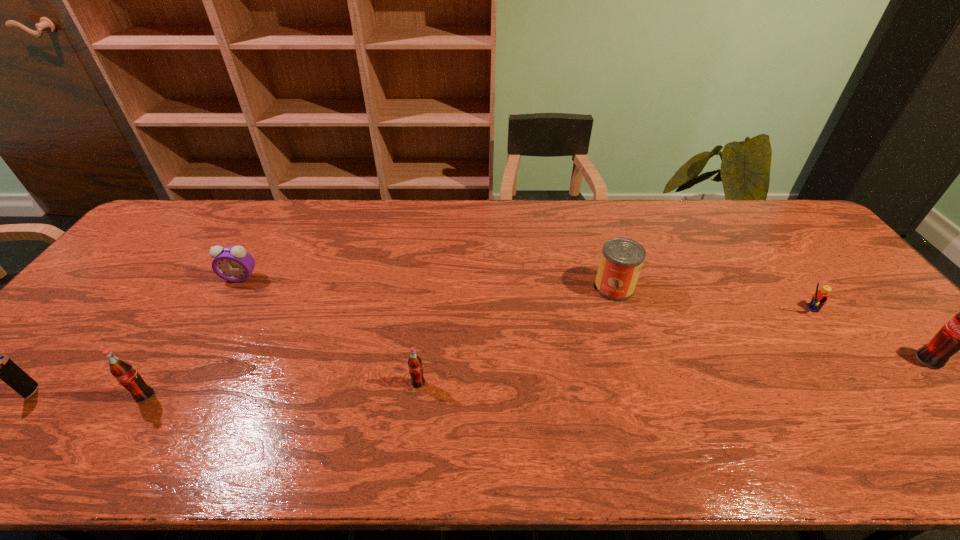
Locate an element on the screen. The width and height of the screenshot is (960, 540). free space that is in between the second tallest soda bottle and the tallest soda bottle is located at coordinates (537, 378).

Identify the location of free space between the third object from right to left and the leftmost object. (323, 339).

The height and width of the screenshot is (540, 960). What are the coordinates of `free space that is in between the fourth object from left to right and the third object from right to left` in the screenshot? It's located at (516, 335).

Where is `vacant space that's between the alarm clock and the fourth object from left to right`? This screenshot has height=540, width=960. vacant space that's between the alarm clock and the fourth object from left to right is located at coordinates (329, 330).

You are a GUI agent. You are given a task and a screenshot of the screen. Output one action in this format:
    pyautogui.click(x=<x>, y=<y>)
    Task: Click on the vacant area between the fourth object from right to left and the sixth object from left to right
    
    Given the screenshot: What is the action you would take?
    pyautogui.click(x=612, y=346)

Identify the location of object identified as the closest to the fourth object from right to left. Image resolution: width=960 pixels, height=540 pixels. (621, 261).

Locate an element on the screen. object that is the sixth closest to the can is located at coordinates (3, 368).

Locate an element on the screen. Image resolution: width=960 pixels, height=540 pixels. soda bottle that is the closest to the alarm clock is located at coordinates (x=123, y=371).

The width and height of the screenshot is (960, 540). What are the coordinates of `the second closest soda bottle relative to the alarm clock` in the screenshot? It's located at (415, 367).

Image resolution: width=960 pixels, height=540 pixels. Find the location of `vacant region that satisfies the following two spatial constraints: 1. on the front-facing side of the Lego; 2. on the label of the second soda bottle from left to right`. vacant region that satisfies the following two spatial constraints: 1. on the front-facing side of the Lego; 2. on the label of the second soda bottle from left to right is located at coordinates (859, 383).